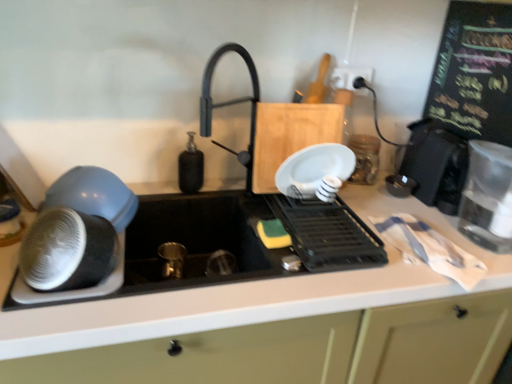
Question: Is black plastic dish rack at center, arranged as the third appliance when viewed from the right, shorter than white plastic electric outlet at upper right?

Choices:
 (A) yes
 (B) no

Answer: (A)

Question: Is black plastic dish rack at center, arranged as the third appliance when viewed from the right, at the right side of white plastic electric outlet at upper right?

Choices:
 (A) yes
 (B) no

Answer: (B)

Question: Is black plastic dish rack at center, positioned as the second appliance in left-to-right order, taller than white plastic electric outlet at upper right?

Choices:
 (A) no
 (B) yes

Answer: (A)

Question: Considering the relative sizes of black plastic dish rack at center, arranged as the third appliance when viewed from the right, and white plastic electric outlet at upper right in the image provided, is black plastic dish rack at center, arranged as the third appliance when viewed from the right, bigger than white plastic electric outlet at upper right?

Choices:
 (A) yes
 (B) no

Answer: (A)

Question: From the image's perspective, would you say black plastic dish rack at center, positioned as the second appliance in left-to-right order, is shown under white plastic electric outlet at upper right?

Choices:
 (A) no
 (B) yes

Answer: (B)

Question: Looking at the image, does clear glass jar at upper right, placed as the second appliance when sorted from right to left, seem bigger or smaller compared to black matte soap dispenser at center?

Choices:
 (A) big
 (B) small

Answer: (A)

Question: Is clear glass jar at upper right, placed as the second appliance when sorted from right to left, spatially inside black matte soap dispenser at center, or outside of it?

Choices:
 (A) outside
 (B) inside

Answer: (A)

Question: Based on their positions, is clear glass jar at upper right, which appears as the 3th appliance when viewed from the left, located to the left or right of black matte soap dispenser at center?

Choices:
 (A) left
 (B) right

Answer: (B)

Question: In the image, is clear glass jar at upper right, which appears as the 3th appliance when viewed from the left, positioned in front of or behind black matte soap dispenser at center?

Choices:
 (A) front
 (B) behind

Answer: (B)

Question: From a real-world perspective, is black plastic toaster at right, the 4th appliance positioned from the left, positioned above or below black plastic dish rack at center, positioned as the second appliance in left-to-right order?

Choices:
 (A) above
 (B) below

Answer: (A)

Question: Is point (423, 193) closer or farther from the camera than point (274, 203)?

Choices:
 (A) farther
 (B) closer

Answer: (A)

Question: Relative to black plastic dish rack at center, positioned as the second appliance in left-to-right order, is black plastic toaster at right, arranged as the first appliance when viewed from the right, in front or behind?

Choices:
 (A) front
 (B) behind

Answer: (B)

Question: From their relative heights in the image, would you say black plastic toaster at right, arranged as the first appliance when viewed from the right, is taller or shorter than black plastic dish rack at center, positioned as the second appliance in left-to-right order?

Choices:
 (A) tall
 (B) short

Answer: (A)

Question: Is white plastic electric outlet at upper right to the left or to the right of black plastic dish rack at center, arranged as the third appliance when viewed from the right, in the image?

Choices:
 (A) right
 (B) left

Answer: (A)

Question: Is white plastic electric outlet at upper right wider or thinner than black plastic dish rack at center, arranged as the third appliance when viewed from the right?

Choices:
 (A) wide
 (B) thin

Answer: (B)